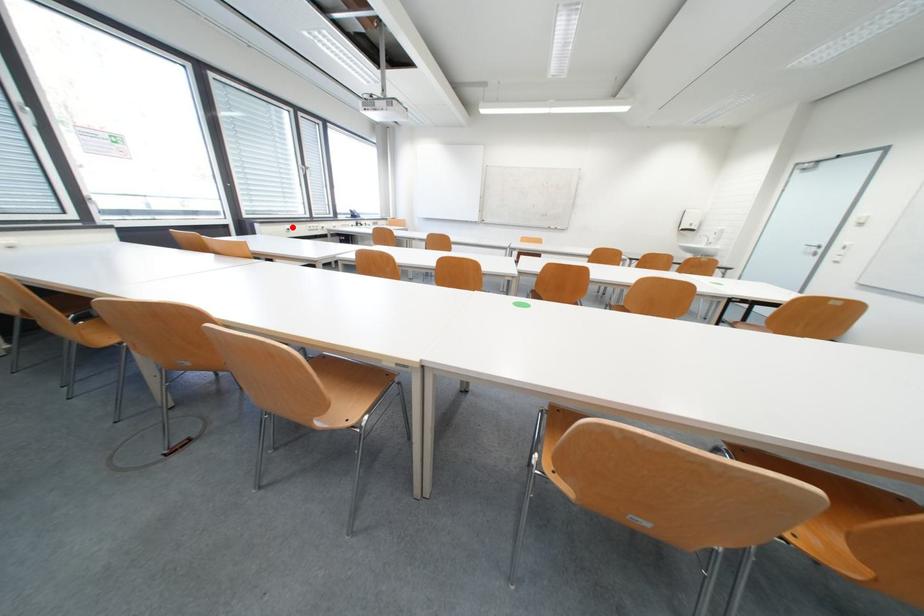
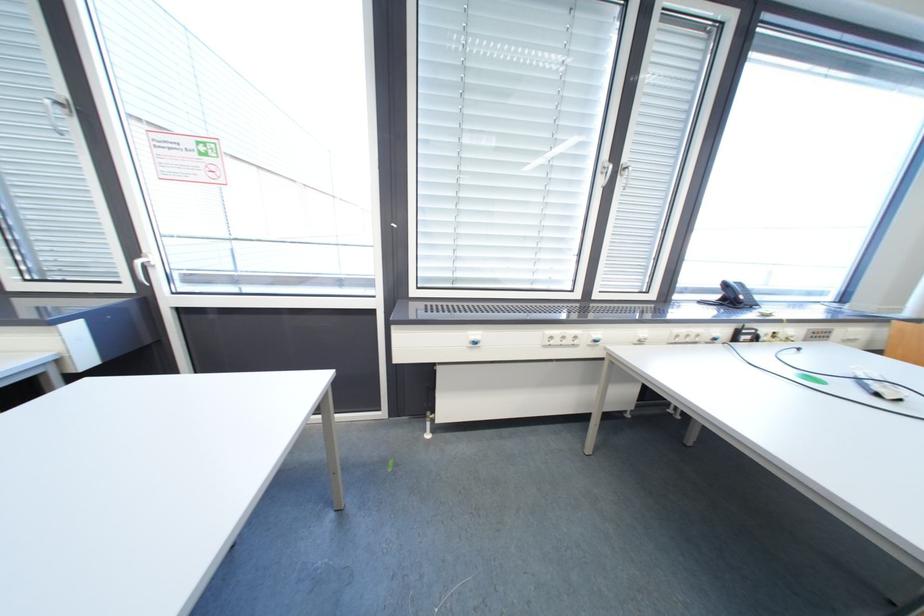
In the second image, find the point that corresponds to the highlighted location in the first image.

(480, 334)